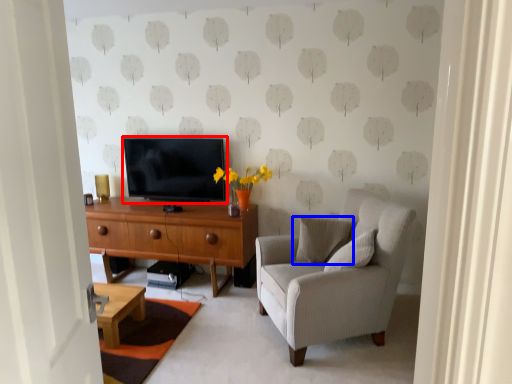
Question: Which object appears closest to the camera in this image, television (highlighted by a red box) or pillow (highlighted by a blue box)?

Choices:
 (A) television
 (B) pillow

Answer: (B)